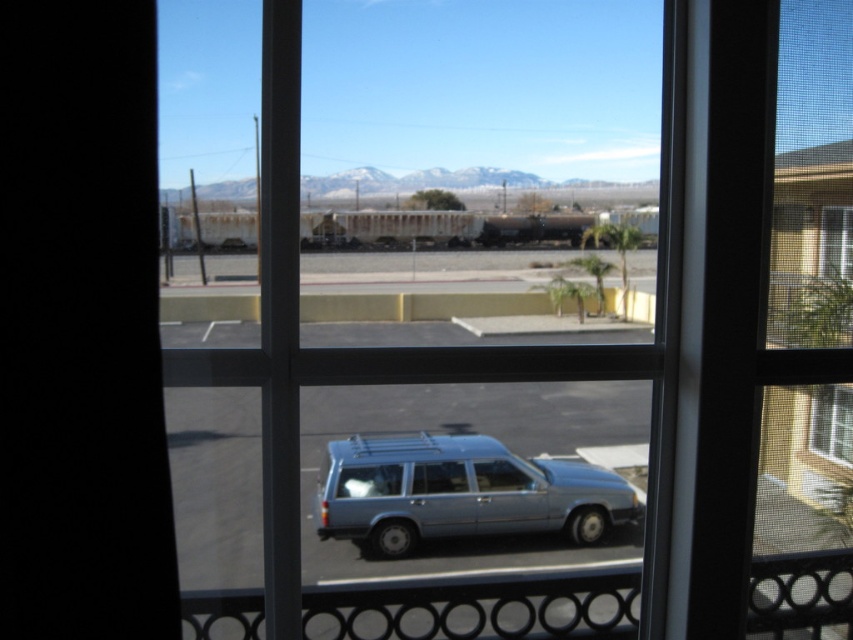
Question: Which of the following is the farthest from the observer?

Choices:
 (A) (286, 276)
 (B) (573, 540)

Answer: (B)

Question: Which point is farther to the camera?

Choices:
 (A) satin blue station wagon at center
 (B) clear glass window at center

Answer: (A)

Question: Observing the image, what is the correct spatial positioning of clear glass window at center in reference to satin blue station wagon at center?

Choices:
 (A) below
 (B) above

Answer: (B)

Question: Can you confirm if clear glass window at center is thinner than satin blue station wagon at center?

Choices:
 (A) no
 (B) yes

Answer: (A)

Question: Is clear glass window at center below satin blue station wagon at center?

Choices:
 (A) no
 (B) yes

Answer: (A)